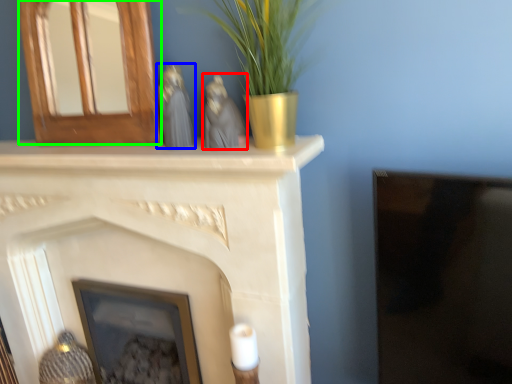
Question: Estimate the real-world distances between objects in this image. Which object is closer to animal (highlighted by a red box), animal (highlighted by a blue box) or fireplace (highlighted by a green box)?

Choices:
 (A) animal
 (B) fireplace

Answer: (A)